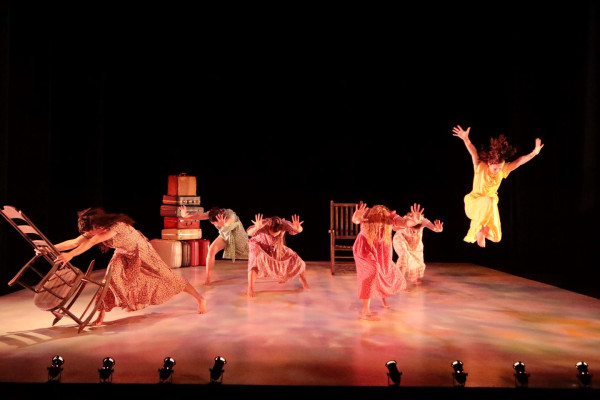
At what (x,y) coordinates should I click in order to perform the action: click on floor. Please return your answer as a coordinate pair (x, y). The image size is (600, 400). Looking at the image, I should click on (338, 344).